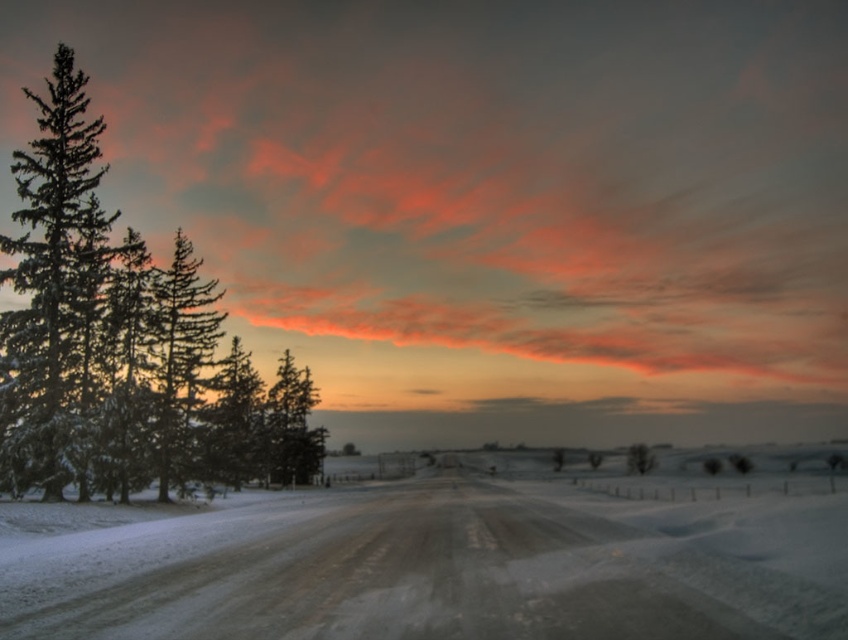
Is point (60, 99) positioned in front of point (53, 356)?

No, (60, 99) is further to viewer.

Who is more forward, (x=26, y=179) or (x=93, y=179)?

Positioned in front is point (x=26, y=179).

Locate an element on the screen. The image size is (848, 640). snow-covered pine trees at left is located at coordinates (123, 342).

Which of these two, white powdery snow at center or green snow-covered trees at left, stands shorter?

Standing shorter between the two is white powdery snow at center.

At what (x,y) coordinates should I click in order to perform the action: click on white powdery snow at center. Please return your answer as a coordinate pair (x, y). Looking at the image, I should click on (441, 561).

Is green snow-covered trees at left bigger than green matte tree at center?

Yes, green snow-covered trees at left is bigger than green matte tree at center.

Between green snow-covered trees at left and green matte tree at center, which one has less height?

green matte tree at center is shorter.

Who is more distant from viewer, (70, 474) or (294, 445)?

The point (294, 445) is behind.

Identify the location of green snow-covered trees at left. (47, 280).